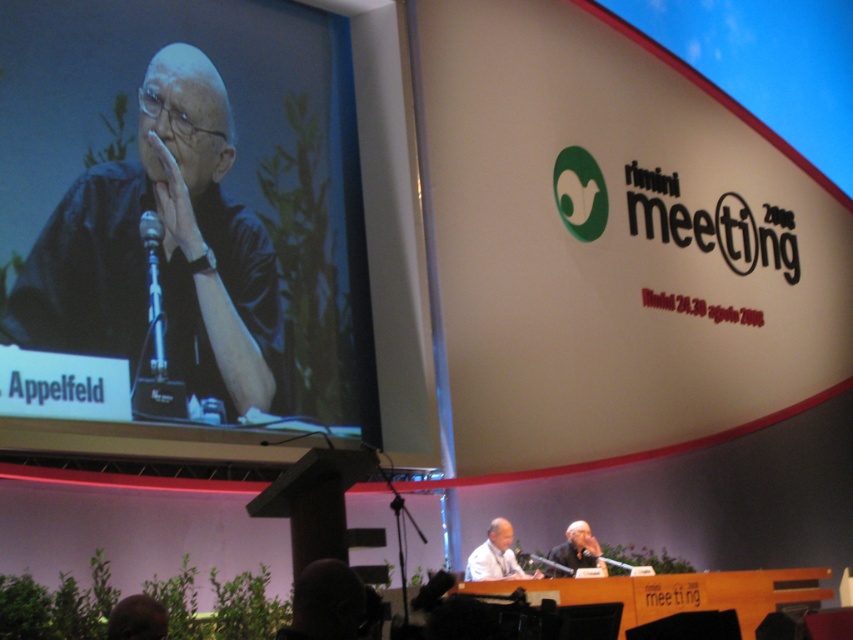
Question: Observing the image, what is the correct spatial positioning of beige matte projection screen at upper center in reference to brown hair at lower left?

Choices:
 (A) below
 (B) above

Answer: (B)

Question: Which of the following is the closest to the observer?

Choices:
 (A) (592, 556)
 (B) (126, 630)
 (C) (590, 260)

Answer: (B)

Question: Can you confirm if black matte/black shirt at upper left is positioned above light beige fabric at lower center?

Choices:
 (A) yes
 (B) no

Answer: (A)

Question: Can you confirm if beige matte projection screen at upper center is positioned below black plastic microphone at upper left?

Choices:
 (A) yes
 (B) no

Answer: (B)

Question: Which object appears closest to the camera in this image?

Choices:
 (A) black matte/black shirt at upper left
 (B) smooth skin bald man at center

Answer: (A)

Question: Which of these objects is positioned closest to the brown hair at lower left?

Choices:
 (A) beige matte projection screen at upper center
 (B) black matte/black shirt at upper left
 (C) smooth skin bald man at center

Answer: (B)